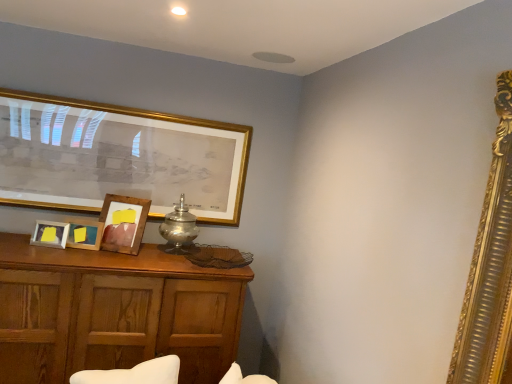
Question: From a real-world perspective, is wooden cabinet at lower left physically located above or below silver metallic table lamp at center?

Choices:
 (A) above
 (B) below

Answer: (B)

Question: Considering the positions of wooden cabinet at lower left and silver metallic table lamp at center in the image, is wooden cabinet at lower left taller or shorter than silver metallic table lamp at center?

Choices:
 (A) short
 (B) tall

Answer: (B)

Question: Which of these objects is positioned closest to the wooden picture frame at center, which is the third picture frame in back-to-front order?

Choices:
 (A) silver metallic table lamp at center
 (B) wooden cabinet at lower left
 (C) wooden picture frame at center, positioned as the second picture frame in back-to-front order
 (D) wooden photo frame at lower left, which appears as the 1th picture frame when viewed from the front
 (E) gold-framed picture at upper left, the fourth picture frame viewed from the front

Answer: (D)

Question: Considering the real-world distances, which object is farthest from the wooden picture frame at center, which is the third picture frame in back-to-front order?

Choices:
 (A) gold-framed picture at upper left, the fourth picture frame viewed from the front
 (B) wooden picture frame at center, positioned as the second picture frame in back-to-front order
 (C) wooden cabinet at lower left
 (D) silver metallic table lamp at center
 (E) wooden photo frame at lower left, which appears as the 1th picture frame when viewed from the front

Answer: (A)